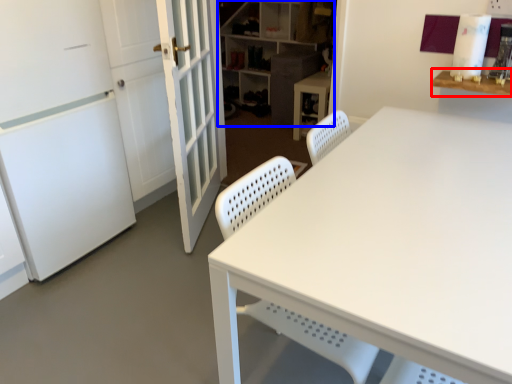
Question: Which object appears closest to the camera in this image, table (highlighted by a red box) or shelf (highlighted by a blue box)?

Choices:
 (A) table
 (B) shelf

Answer: (A)